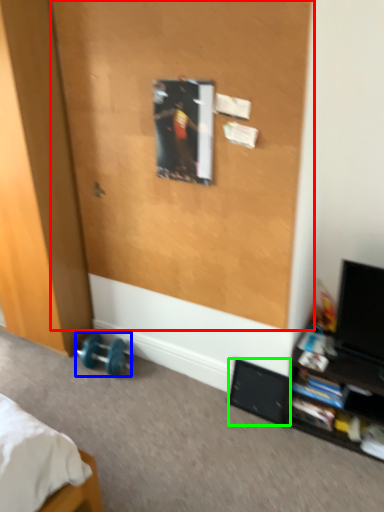
Question: Based on their relative distances, which object is farther from screen door (highlighted by a red box)? Choose from dumbbell (highlighted by a blue box) and speaker (highlighted by a green box).

Choices:
 (A) dumbbell
 (B) speaker

Answer: (A)